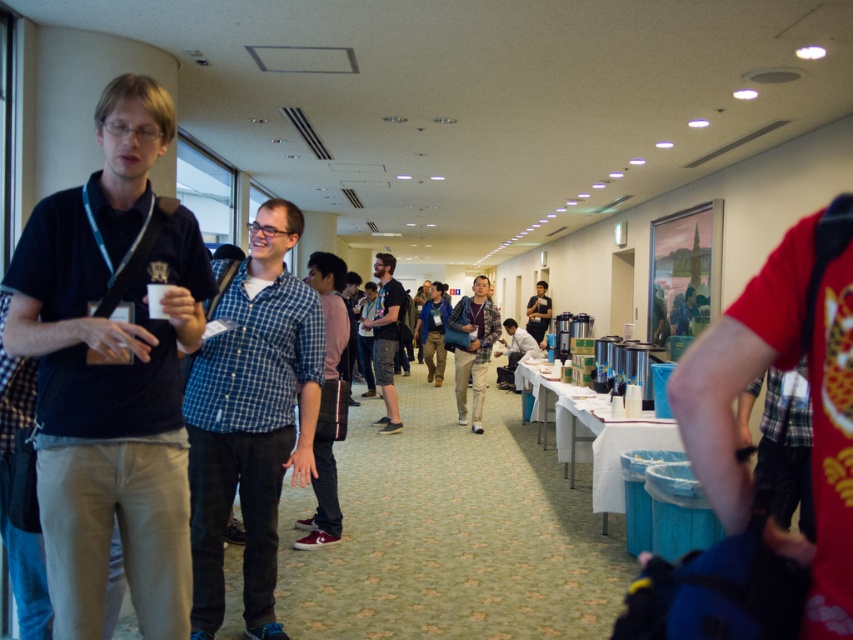
You are standing in the conference hall and need to locate the person wearing the dark blue shirt at left. According to the coordinates provided, where exactly would you find them?

The dark blue shirt at left is located at point (x=112, y=369).

You are organizing a photo shoot in this conference hall and need to position two models wearing dark blue shirts. The first model is wearing the dark blue shirt at left and the second model is wearing the dark blue shirt at center. Which model should you place closer to the camera to ensure their shirt appears wider in the photo?

The dark blue shirt at center should be placed closer to the camera because its actual width is greater than the dark blue shirt at left, so when positioned closer, it will appear wider in the photo.

You are standing at the entrance of the corridor and see a dark blue shirt at left and a blue denim jacket at center. Which one is closer to you?

The dark blue shirt at left is 10.40 meters away from the blue denim jacket at center, so the one closer to you would depend on your position. However, since the dark blue shirt is at the left and the jacket is at the center, the dark blue shirt at left is likely closer to the entrance.